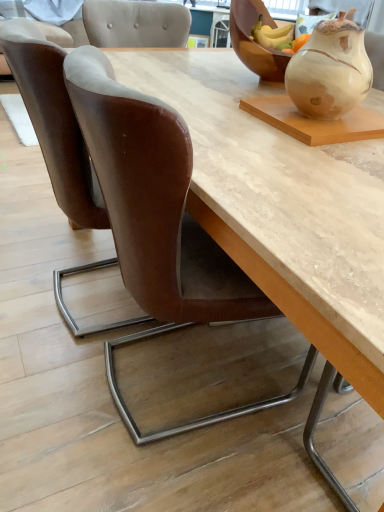
Locate an element on the screen. The height and width of the screenshot is (512, 384). free space to the left of wooden bowl at upper right is located at coordinates (181, 75).